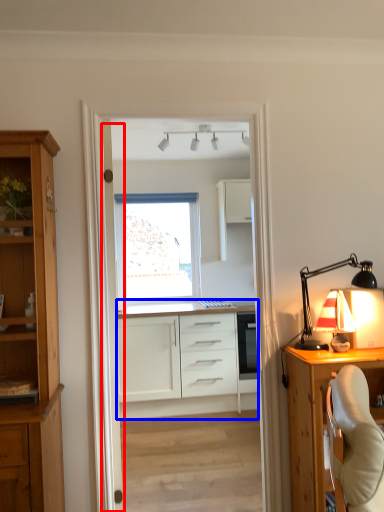
Question: Which object appears closest to the camera in this image, door (highlighted by a red box) or cabinetry (highlighted by a blue box)?

Choices:
 (A) door
 (B) cabinetry

Answer: (A)